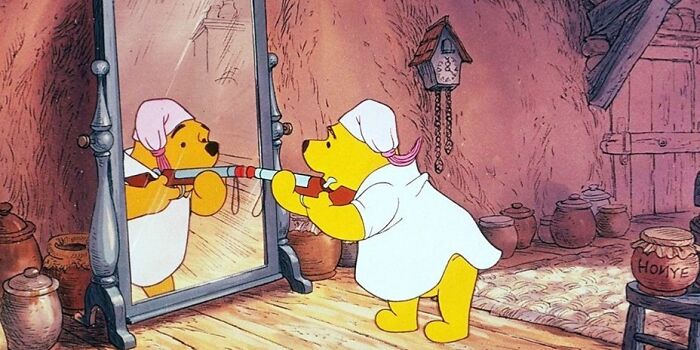
You are a GUI agent. You are given a task and a screenshot of the screen. Output one action in this format:
    pyautogui.click(x=<x>, y=<y>)
    Task: Click on the floor rug
    This screenshot has width=700, height=350.
    Given the screenshot: What is the action you would take?
    pyautogui.click(x=567, y=280)